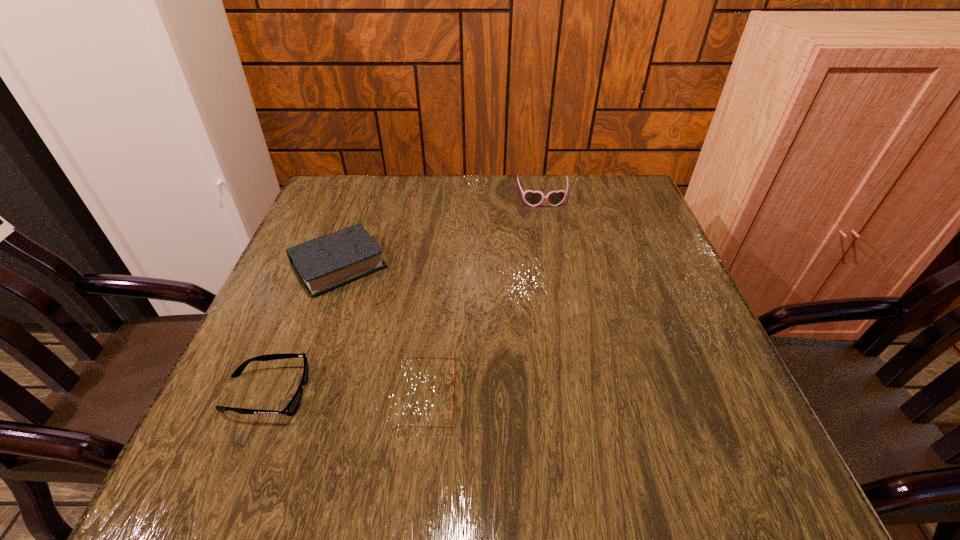
This screenshot has width=960, height=540. I want to click on object that can be found as the second closest to the Bible, so click(x=451, y=426).

Select which object is the third closest to the third nearest object. Please provide its 2D coordinates. Your answer should be formatted as a tuple, i.e. [(x, y)], where the tuple contains the x and y coordinates of a point satisfying the conditions above.

[(533, 198)]

The height and width of the screenshot is (540, 960). What are the coordinates of `sunglasses object that ranks as the second closest to the second object from right to left` in the screenshot? It's located at (533, 198).

At what (x,y) coordinates should I click in order to perform the action: click on the second closest sunglasses to the leftmost sunglasses. Please return your answer as a coordinate pair (x, y). The width and height of the screenshot is (960, 540). Looking at the image, I should click on (533, 198).

Where is `free space that satisfies the following two spatial constraints: 1. on the front-facing side of the farthest sunglasses; 2. on the face of the second sunglasses from left to right`? free space that satisfies the following two spatial constraints: 1. on the front-facing side of the farthest sunglasses; 2. on the face of the second sunglasses from left to right is located at coordinates (579, 397).

The width and height of the screenshot is (960, 540). In order to click on vacant space that satisfies the following two spatial constraints: 1. on the front-facing side of the rightmost object; 2. on the front-facing side of the leftmost sunglasses in this screenshot , I will do `click(579, 393)`.